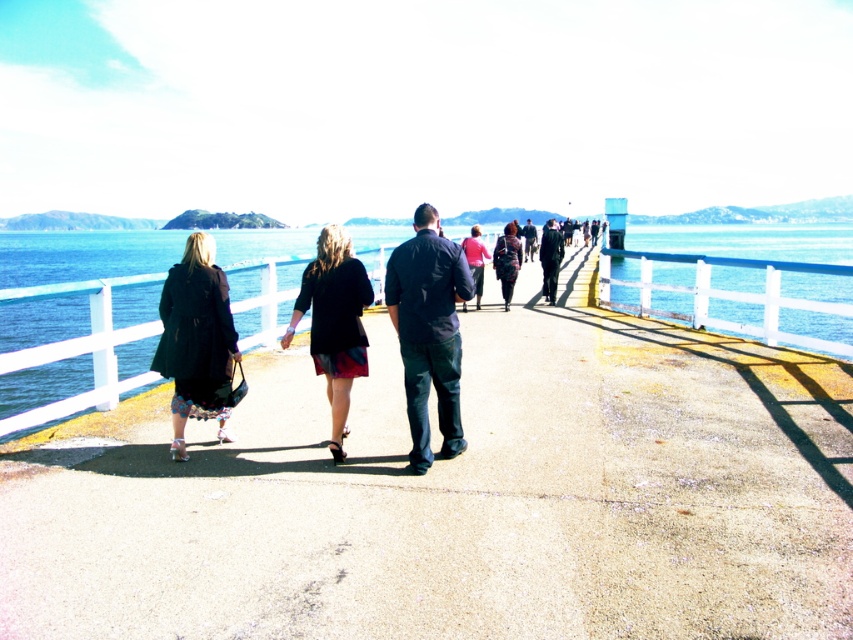
You are a photographer trying to capture a person wearing dark blue shirt at center and dark blue jeans at center. Since both items are dark blue, how can you distinguish which part of their outfit is the shirt versus the jeans?

The dark blue shirt at center is positioned on the left side of dark blue jeans at center, so the left side of the outfit is the shirt and the right side is the jeans.